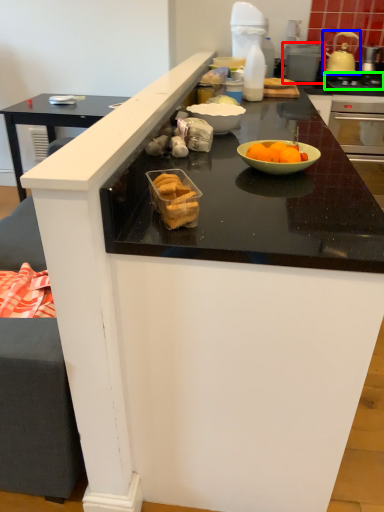
Question: Which object is the farthest from appliance (highlighted by a red box)? Choose among these: kitchen appliance (highlighted by a blue box) or gas stove (highlighted by a green box).

Choices:
 (A) kitchen appliance
 (B) gas stove

Answer: (B)